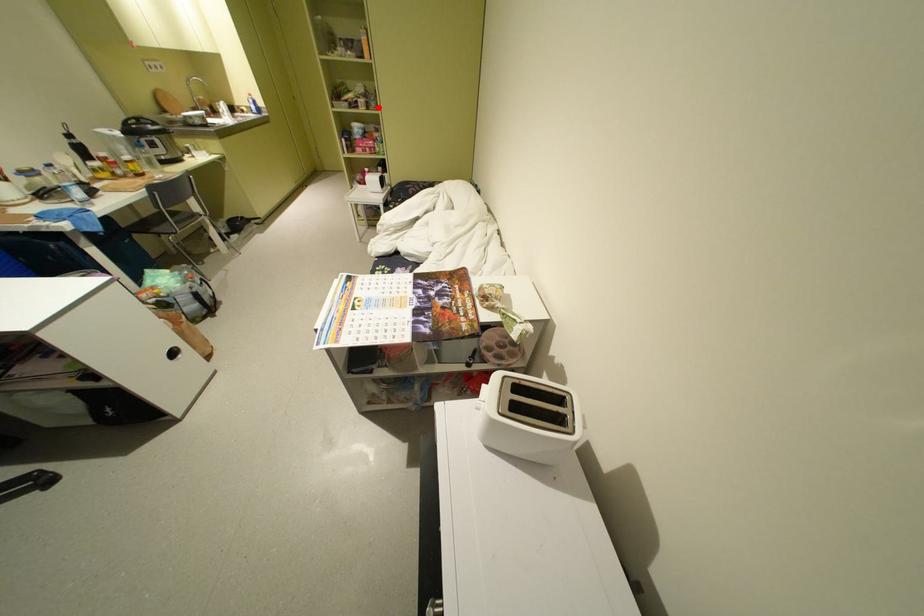
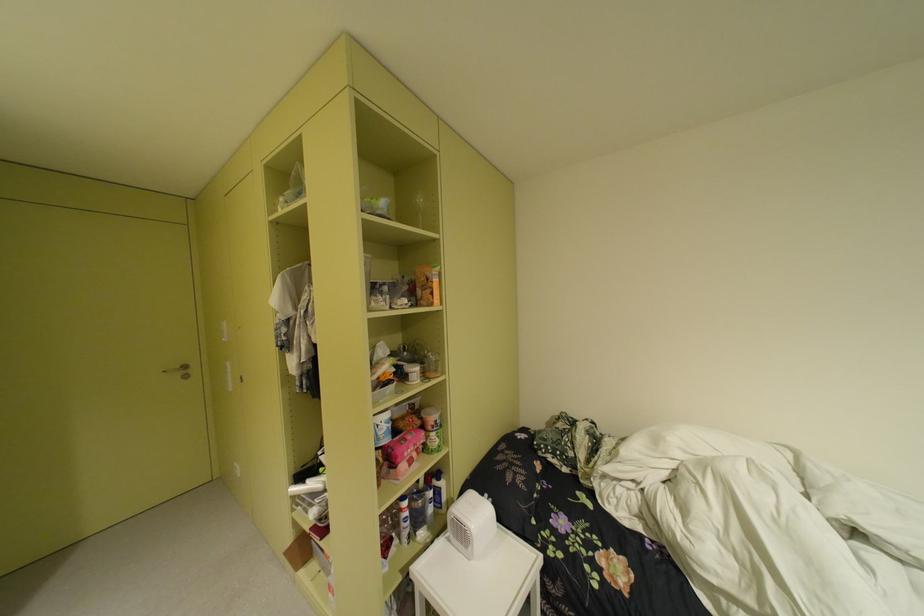
Where in the second image is the point corresponding to the highlighted location from the first image?

(434, 376)